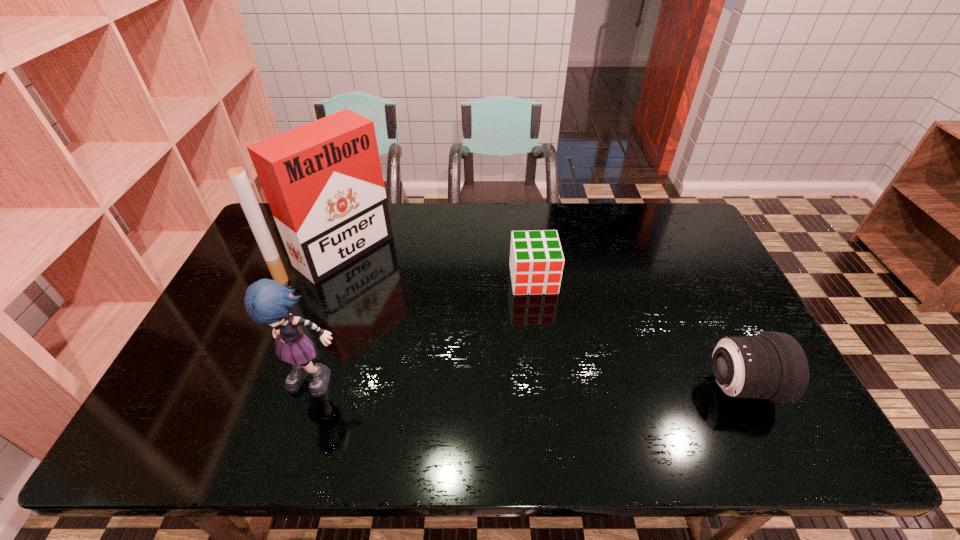
The image size is (960, 540). In the image, there is a desktop. Find the location of `blank space at the near edge`. blank space at the near edge is located at coordinates (253, 389).

The width and height of the screenshot is (960, 540). In order to click on free space at the left edge in this screenshot , I will do `click(254, 325)`.

Where is `vacant area at the right edge`? Image resolution: width=960 pixels, height=540 pixels. vacant area at the right edge is located at coordinates (694, 296).

Find the location of a particular element. Image resolution: width=960 pixels, height=540 pixels. vacant position at the near left corner of the desktop is located at coordinates [x=176, y=390].

I want to click on blank space at the far right corner, so click(x=663, y=205).

Locate an element on the screen. The image size is (960, 540). empty space between the third tallest object and the tallest object is located at coordinates (540, 319).

In order to click on empty space that is in between the third tallest object and the cube in this screenshot , I will do `click(636, 333)`.

Locate an element on the screen. This screenshot has height=540, width=960. unoccupied area between the shortest object and the tallest object is located at coordinates (436, 265).

The width and height of the screenshot is (960, 540). Identify the location of vacant area between the third tallest object and the cigarette case. (540, 319).

At what (x,y) coordinates should I click in order to perform the action: click on vacant area between the third shortest object and the telephoto lens. Please return your answer as a coordinate pair (x, y). The width and height of the screenshot is (960, 540). Looking at the image, I should click on (529, 383).